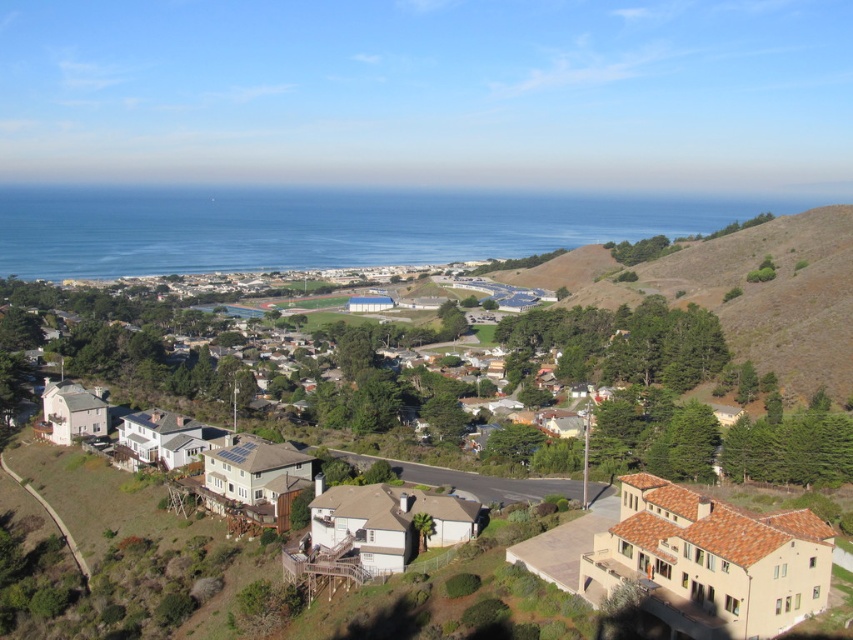
You are standing at the point with coordinates point (323,227) in the coastal residential area. What do you see directly in front of you?

You see blue water at center directly in front of you because point (323,227) corresponds to blue water at center.